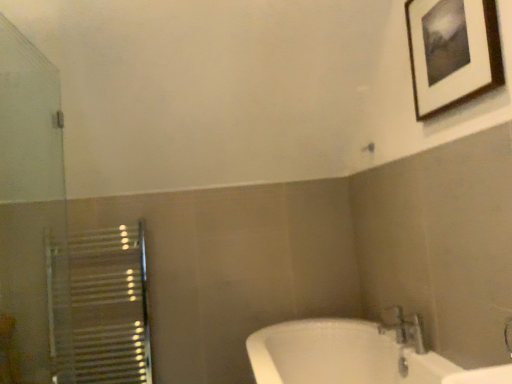
Question: Could you tell me if transparent glass screen door at left is facing wooden-framed picture at upper right?

Choices:
 (A) yes
 (B) no

Answer: (B)

Question: Is transparent glass screen door at left positioned beyond the bounds of wooden-framed picture at upper right?

Choices:
 (A) no
 (B) yes

Answer: (B)

Question: Is transparent glass screen door at left wider than wooden-framed picture at upper right?

Choices:
 (A) yes
 (B) no

Answer: (A)

Question: Does transparent glass screen door at left appear on the right side of wooden-framed picture at upper right?

Choices:
 (A) no
 (B) yes

Answer: (A)

Question: From the image's perspective, would you say transparent glass screen door at left is shown under wooden-framed picture at upper right?

Choices:
 (A) no
 (B) yes

Answer: (B)

Question: Is transparent glass screen door at left at the left side of wooden-framed picture at upper right?

Choices:
 (A) no
 (B) yes

Answer: (B)

Question: From the image's perspective, is wooden-framed picture at upper right located beneath metallic silver faucet at lower right?

Choices:
 (A) no
 (B) yes

Answer: (A)

Question: Is there a large distance between wooden-framed picture at upper right and metallic silver faucet at lower right?

Choices:
 (A) no
 (B) yes

Answer: (B)

Question: Could you tell me if wooden-framed picture at upper right is facing metallic silver faucet at lower right?

Choices:
 (A) yes
 (B) no

Answer: (B)

Question: From the image's perspective, is wooden-framed picture at upper right above metallic silver faucet at lower right?

Choices:
 (A) no
 (B) yes

Answer: (B)

Question: Does wooden-framed picture at upper right come behind metallic silver faucet at lower right?

Choices:
 (A) no
 (B) yes

Answer: (A)

Question: Is wooden-framed picture at upper right beside metallic silver faucet at lower right?

Choices:
 (A) no
 (B) yes

Answer: (A)

Question: Is transparent glass screen door at left smaller than metallic silver faucet at lower right?

Choices:
 (A) no
 (B) yes

Answer: (A)